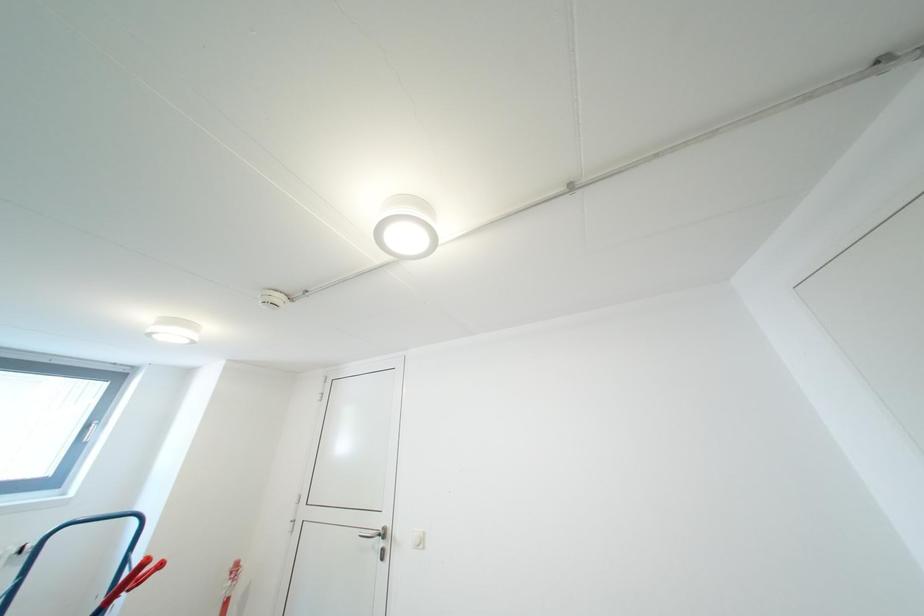
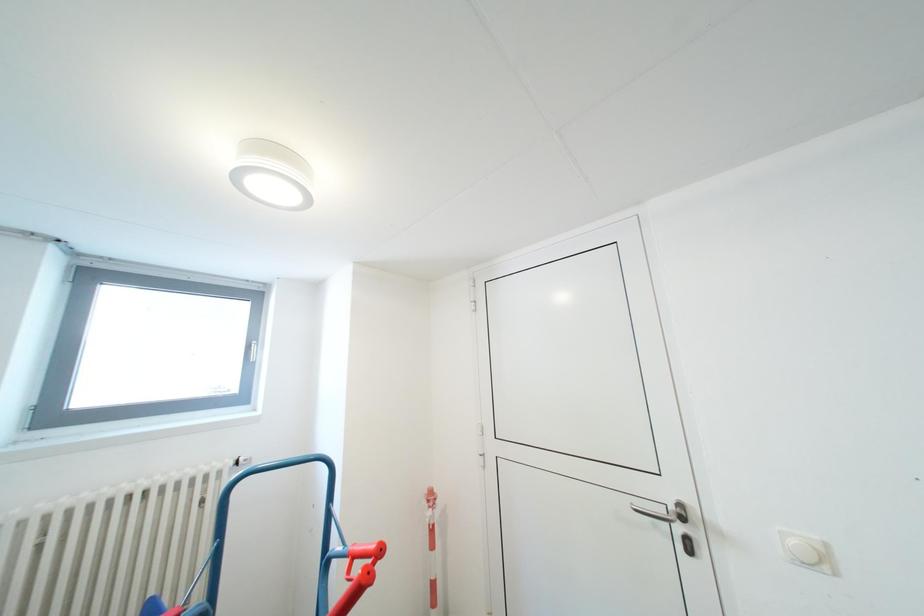
The images are taken continuously from a first-person perspective. In which direction are you moving?

The cameraman moved toward left, forward.